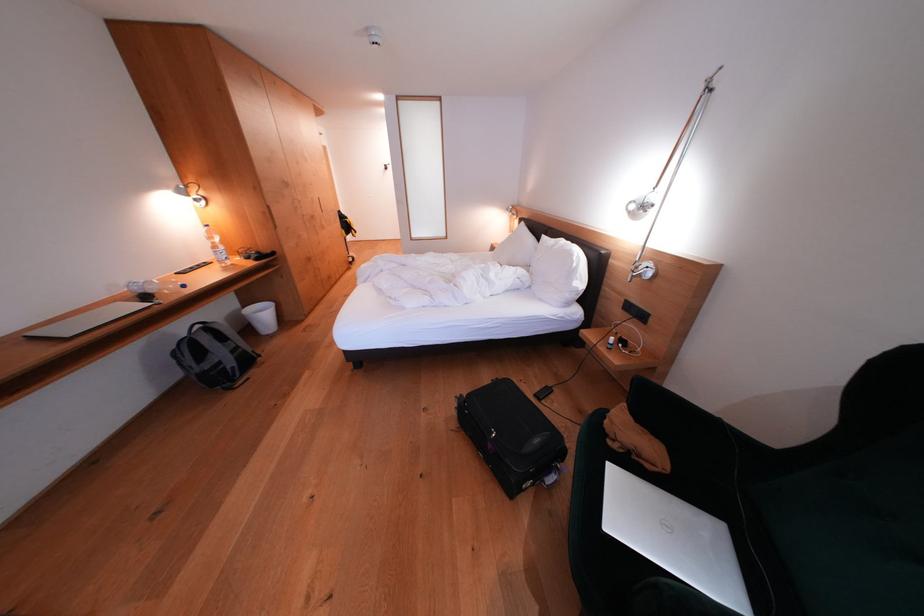
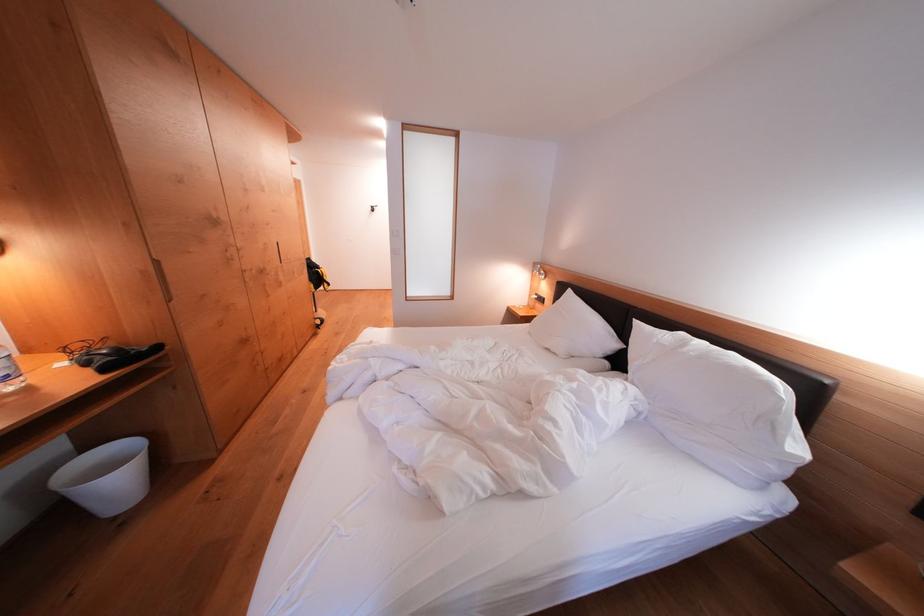
Where in the second image is the point corresponding to (551,241) from the first image?

(642, 326)